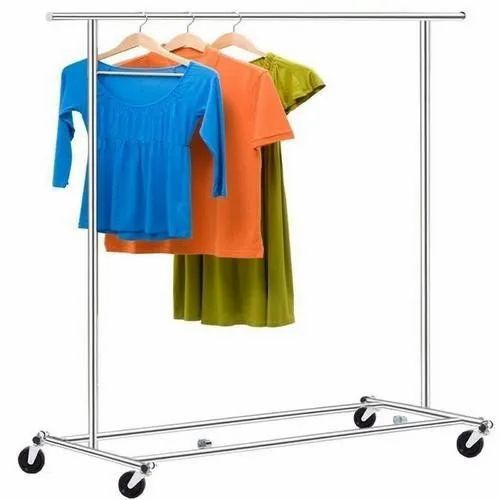
Locate an element on the screen. The width and height of the screenshot is (500, 500). additional hangers not in image is located at coordinates (100, 17), (114, 16), (257, 16), (280, 16).